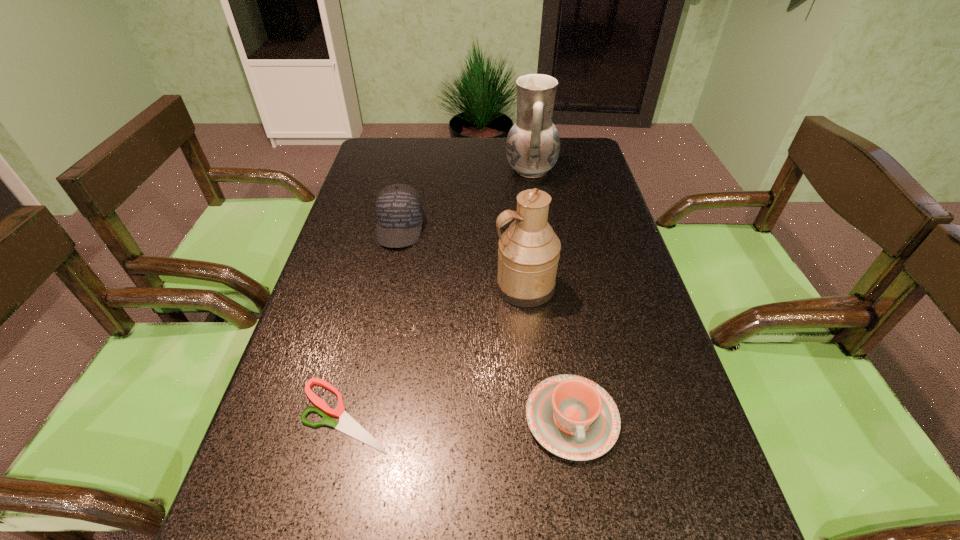
I want to click on blank region between the chinaware and the scissors, so click(459, 417).

Find the location of a particular element. The height and width of the screenshot is (540, 960). unoccupied position between the scissors and the baseball cap is located at coordinates (372, 321).

Find the location of a particular element. The height and width of the screenshot is (540, 960). the closest object to the shortest object is located at coordinates tap(574, 418).

Identify the location of the closest object to the scissors. This screenshot has width=960, height=540. (574, 418).

Image resolution: width=960 pixels, height=540 pixels. I want to click on vacant space that satisfies the following two spatial constraints: 1. on the front-facing side of the farther pitcher; 2. on the front side of the shortest object, so click(x=569, y=415).

Locate an element on the screen. Image resolution: width=960 pixels, height=540 pixels. free space that satisfies the following two spatial constraints: 1. on the front-facing side of the farther pitcher; 2. on the front side of the third nearest object is located at coordinates (549, 287).